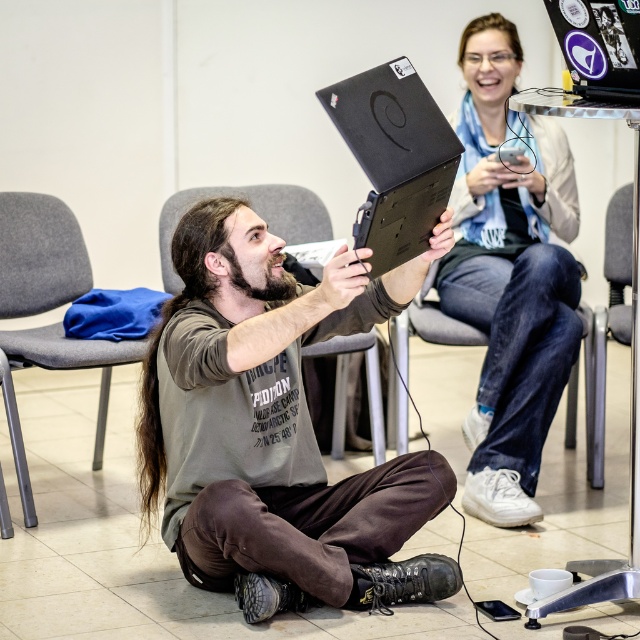
Question: Can you confirm if gray fabric chair at lower left is bigger than gray fabric chair at center?

Choices:
 (A) no
 (B) yes

Answer: (B)

Question: Which object is the farthest from the gray fabric chair at center?

Choices:
 (A) metallic gray chair at center
 (B) matte black laptop at center

Answer: (B)

Question: Which point is closer to the camera?

Choices:
 (A) (563, 346)
 (B) (515, 499)
 (C) (612, 301)
 (D) (262, 195)

Answer: (B)

Question: Observing the image, what is the correct spatial positioning of gray fabric chair at lower center in reference to metallic gray chair at center?

Choices:
 (A) left
 (B) right

Answer: (A)

Question: Which point is closer to the camera?

Choices:
 (A) blue scarf at upper right
 (B) matte black laptop at center

Answer: (B)

Question: Considering the relative positions of gray fabric chair at lower center and black matte laptop at center in the image provided, where is gray fabric chair at lower center located with respect to black matte laptop at center?

Choices:
 (A) above
 (B) below

Answer: (B)